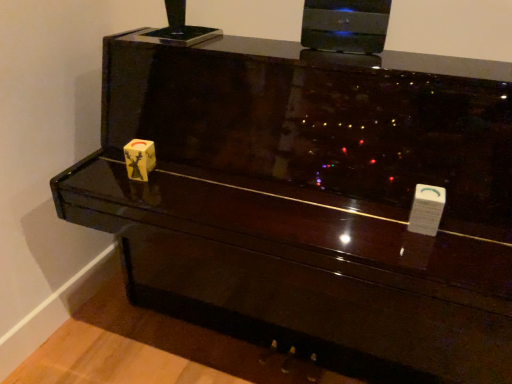
The image size is (512, 384). What are the coordinates of `vacant area that is in front of black glossy laptop at upper center` in the screenshot? It's located at (359, 68).